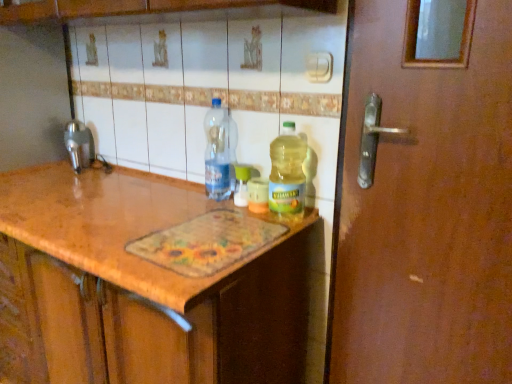
Question: In terms of width, does brushed metal faucet at left look wider or thinner when compared to translucent plastic bottle at center, which is the third bottle from left to right?

Choices:
 (A) wide
 (B) thin

Answer: (A)

Question: Considering the positions of brushed metal faucet at left and translucent plastic bottle at center, which is the third bottle from left to right, in the image, is brushed metal faucet at left bigger or smaller than translucent plastic bottle at center, which is the third bottle from left to right,?

Choices:
 (A) small
 (B) big

Answer: (A)

Question: Estimate the real-world distances between objects in this image. Which object is closer to the brushed metal faucet at left?

Choices:
 (A) translucent plastic bottle at center, positioned as the 2th bottle in right-to-left order
 (B) translucent plastic bottle at center, the first bottle viewed from the right
 (C) transparent plastic bottle at center, the 1th bottle when ordered from left to right

Answer: (C)

Question: Estimate the real-world distances between objects in this image. Which object is closer to the translucent plastic bottle at center, the first bottle viewed from the right?

Choices:
 (A) brushed metal faucet at left
 (B) transparent plastic bottle at center, the 1th bottle when ordered from left to right
 (C) translucent plastic bottle at center, which ranks as the second bottle in left-to-right order

Answer: (C)